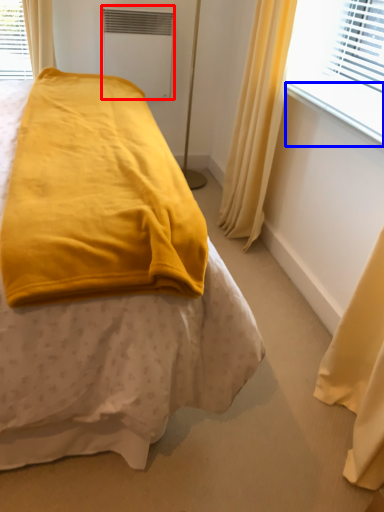
Question: Among these objects, which one is farthest to the camera, air conditioning (highlighted by a red box) or window sill (highlighted by a blue box)?

Choices:
 (A) air conditioning
 (B) window sill

Answer: (A)